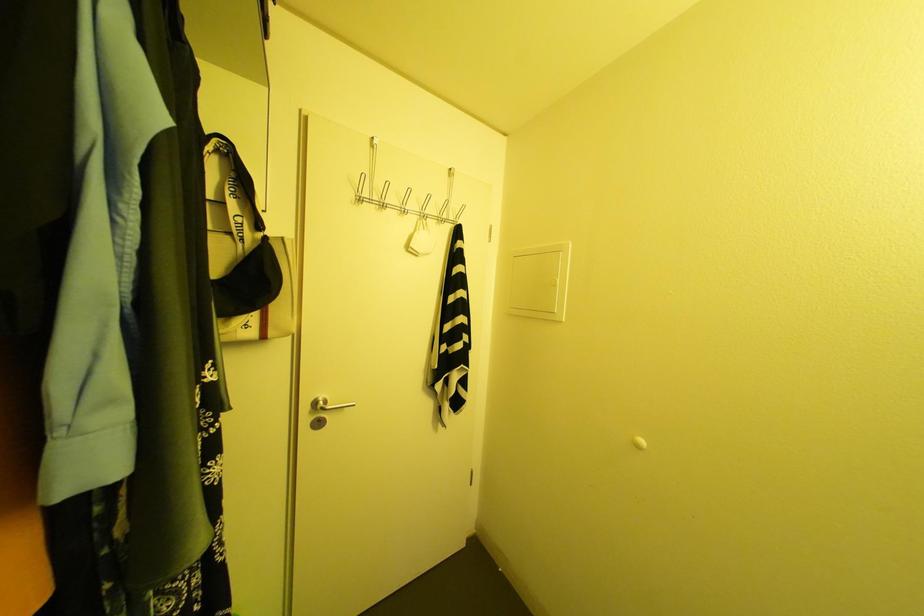
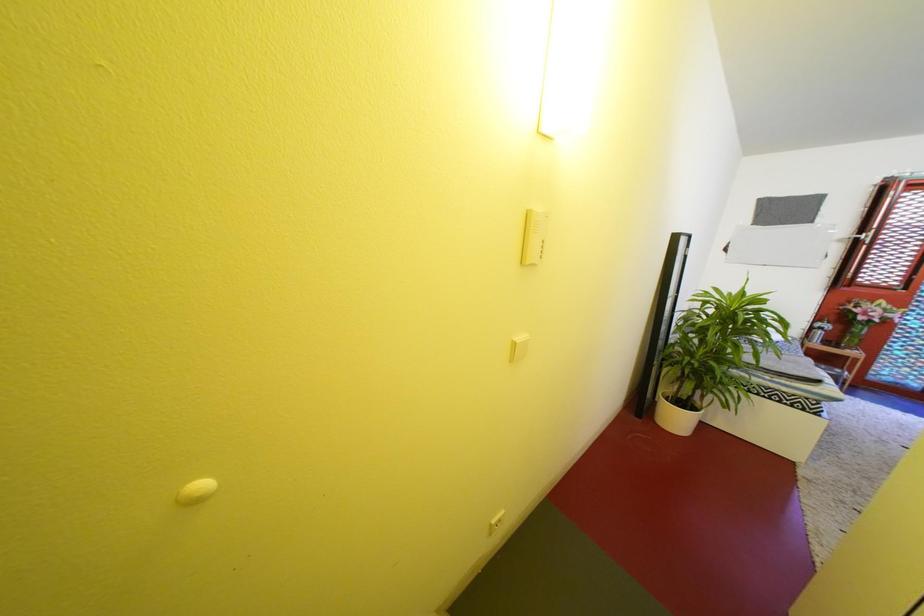
The first image is from the beginning of the video and the second image is from the end. How did the camera likely rotate when shooting the video?

The camera's rotation is toward right-down.